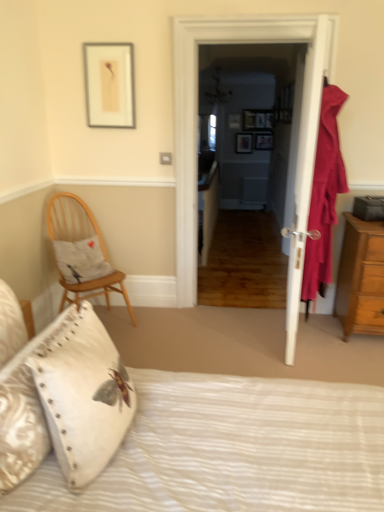
Question: Considering the relative positions of brown wooden chest of drawers at right and wooden picture frame at center, the fifth picture frame viewed from the front, in the image provided, is brown wooden chest of drawers at right to the right of wooden picture frame at center, the fifth picture frame viewed from the front, from the viewer's perspective?

Choices:
 (A) yes
 (B) no

Answer: (A)

Question: Does brown wooden chest of drawers at right have a lesser width compared to wooden picture frame at center, the first picture frame in the back-to-front sequence?

Choices:
 (A) yes
 (B) no

Answer: (B)

Question: From a real-world perspective, is brown wooden chest of drawers at right located higher than wooden picture frame at center, the first picture frame in the back-to-front sequence?

Choices:
 (A) no
 (B) yes

Answer: (A)

Question: Is brown wooden chest of drawers at right oriented away from wooden picture frame at center, acting as the third picture frame starting from the left?

Choices:
 (A) yes
 (B) no

Answer: (A)

Question: Is brown wooden chest of drawers at right at the left side of wooden picture frame at center, the third picture frame when ordered from top to bottom?

Choices:
 (A) no
 (B) yes

Answer: (A)

Question: Can you confirm if brown wooden chest of drawers at right is bigger than wooden picture frame at center, the fifth picture frame viewed from the front?

Choices:
 (A) no
 (B) yes

Answer: (B)

Question: Would you consider white cotton pillow at left, which is the 3th pillow from front to back, to be distant from velvet red curtain at right?

Choices:
 (A) yes
 (B) no

Answer: (A)

Question: Is the position of white cotton pillow at left, which is the 1th pillow in back-to-front order, more distant than that of velvet red curtain at right?

Choices:
 (A) no
 (B) yes

Answer: (B)

Question: From a real-world perspective, is white cotton pillow at left, which is the 1th pillow in back-to-front order, located beneath velvet red curtain at right?

Choices:
 (A) no
 (B) yes

Answer: (B)

Question: Is white cotton pillow at left, which is the 3th pillow from front to back, oriented away from velvet red curtain at right?

Choices:
 (A) yes
 (B) no

Answer: (B)

Question: Does white cotton pillow at left, which is the 3th pillow from front to back, have a lesser height compared to velvet red curtain at right?

Choices:
 (A) yes
 (B) no

Answer: (A)

Question: Can you confirm if white cotton pillow at left, which is the 1th pillow in back-to-front order, is bigger than velvet red curtain at right?

Choices:
 (A) no
 (B) yes

Answer: (A)

Question: Could you tell me if wooden picture frame at center, positioned as the fourth picture frame in front-to-back order, is facing velvet red curtain at right?

Choices:
 (A) no
 (B) yes

Answer: (B)